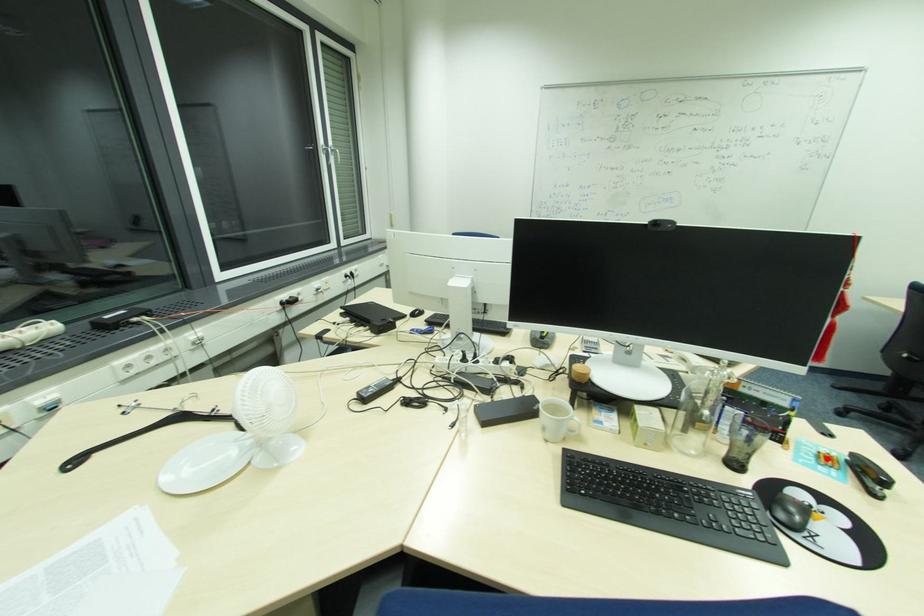
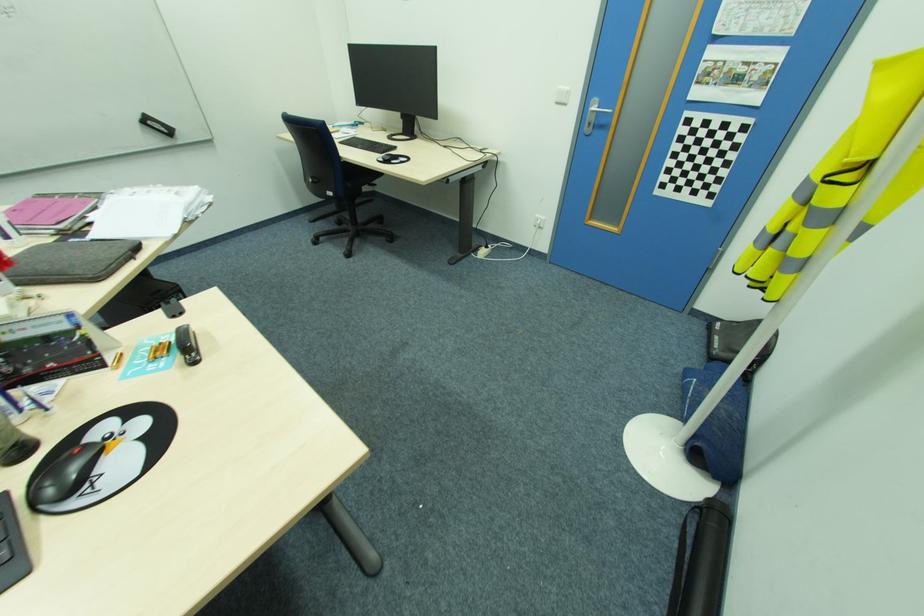
The point at the highlighted location is marked in the first image. Where is the corresponding point in the second image?

(164, 350)